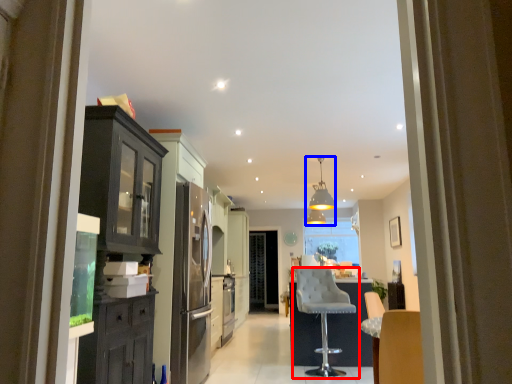
Question: Which object is closer to the camera taking this photo, chair (highlighted by a red box) or light fixture (highlighted by a blue box)?

Choices:
 (A) chair
 (B) light fixture

Answer: (A)